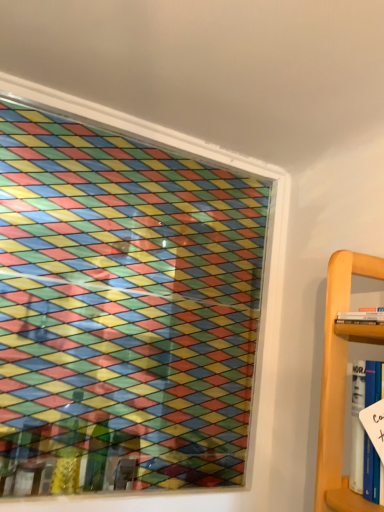
Question: Considering the relative sizes of white paper at right, marked as the 1th book in a bottom-to-top arrangement, and white paperback book at right, the 2th book when ordered from bottom to top, in the image provided, is white paper at right, marked as the 1th book in a bottom-to-top arrangement, bigger than white paperback book at right, the 2th book when ordered from bottom to top,?

Choices:
 (A) yes
 (B) no

Answer: (A)

Question: Is white paper at right, marked as the 1th book in a bottom-to-top arrangement, oriented away from white paperback book at right, which ranks as the 1th book in top-to-bottom order?

Choices:
 (A) yes
 (B) no

Answer: (B)

Question: From the image's perspective, is white paper at right, marked as the 1th book in a bottom-to-top arrangement, on white paperback book at right, the 2th book when ordered from bottom to top?

Choices:
 (A) no
 (B) yes

Answer: (A)

Question: Is white paper at right, marked as the 1th book in a bottom-to-top arrangement, touching white paperback book at right, the 2th book when ordered from bottom to top?

Choices:
 (A) no
 (B) yes

Answer: (A)

Question: Would you say white paper at right, marked as the 1th book in a bottom-to-top arrangement, is a long distance from white paperback book at right, which ranks as the 1th book in top-to-bottom order?

Choices:
 (A) yes
 (B) no

Answer: (B)

Question: From a real-world perspective, is white paper at right, acting as the 2th book starting from the top, below white paperback book at right, which ranks as the 1th book in top-to-bottom order?

Choices:
 (A) no
 (B) yes

Answer: (B)

Question: Is the surface of white paperback book at right, which ranks as the 1th book in top-to-bottom order, in direct contact with white paper at right, marked as the 1th book in a bottom-to-top arrangement?

Choices:
 (A) no
 (B) yes

Answer: (A)

Question: From a real-world perspective, is white paperback book at right, the 2th book when ordered from bottom to top, located beneath white paper at right, marked as the 1th book in a bottom-to-top arrangement?

Choices:
 (A) no
 (B) yes

Answer: (A)

Question: Is white paperback book at right, which ranks as the 1th book in top-to-bottom order, thinner than white paper at right, marked as the 1th book in a bottom-to-top arrangement?

Choices:
 (A) yes
 (B) no

Answer: (B)

Question: Is white paperback book at right, which ranks as the 1th book in top-to-bottom order, at the right side of white paper at right, marked as the 1th book in a bottom-to-top arrangement?

Choices:
 (A) no
 (B) yes

Answer: (B)

Question: Is white paperback book at right, the 2th book when ordered from bottom to top, at the left side of white paper at right, acting as the 2th book starting from the top?

Choices:
 (A) no
 (B) yes

Answer: (A)

Question: Does white paperback book at right, which ranks as the 1th book in top-to-bottom order, have a greater width compared to white paper at right, acting as the 2th book starting from the top?

Choices:
 (A) yes
 (B) no

Answer: (A)

Question: From a real-world perspective, is white paper at right, acting as the 2th book starting from the top, positioned above or below white paperback book at right, which ranks as the 1th book in top-to-bottom order?

Choices:
 (A) below
 (B) above

Answer: (A)